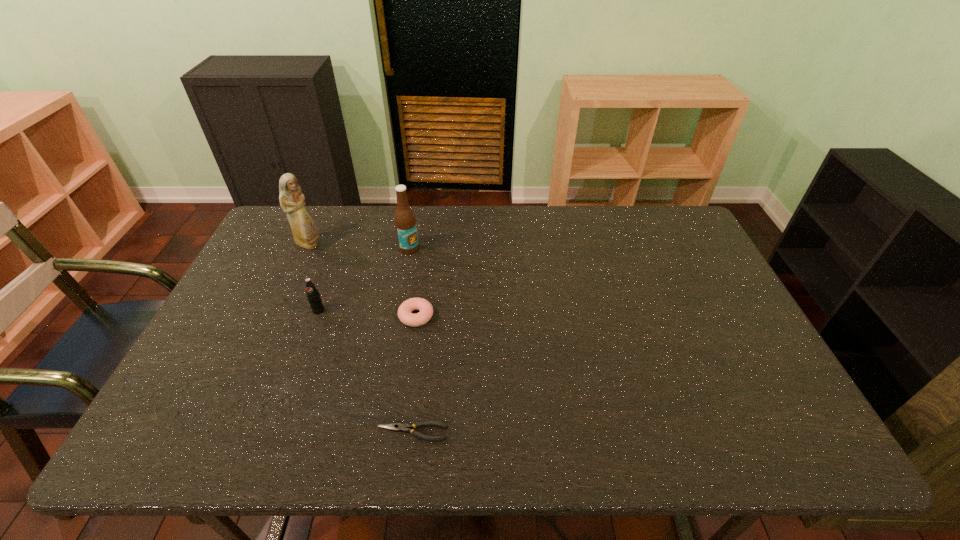
Identify the location of vacant point located between the beer bottle and the leftmost object. (359, 247).

Where is `vacant area that lies between the pop and the figurine`? The height and width of the screenshot is (540, 960). vacant area that lies between the pop and the figurine is located at coordinates (314, 278).

Choose which object is the fourth nearest neighbor to the nearest object. Please provide its 2D coordinates. Your answer should be formatted as a tuple, i.e. [(x, y)], where the tuple contains the x and y coordinates of a point satisfying the conditions above.

[(305, 231)]

Image resolution: width=960 pixels, height=540 pixels. Find the location of `object that can be found as the third closest to the beer bottle`. object that can be found as the third closest to the beer bottle is located at coordinates (313, 295).

Where is `free region that satisfies the following two spatial constraints: 1. on the front label of the pliers; 2. on the left side of the pop`? free region that satisfies the following two spatial constraints: 1. on the front label of the pliers; 2. on the left side of the pop is located at coordinates (275, 432).

Identify the location of blank area in the image that satisfies the following two spatial constraints: 1. on the front-facing side of the figurine; 2. on the back side of the beer bottle. The width and height of the screenshot is (960, 540). (307, 248).

Where is `vacant region that satisfies the following two spatial constraints: 1. on the front-facing side of the nearest object; 2. on the left side of the figurine`? vacant region that satisfies the following two spatial constraints: 1. on the front-facing side of the nearest object; 2. on the left side of the figurine is located at coordinates (225, 432).

The image size is (960, 540). I want to click on vacant position in the image that satisfies the following two spatial constraints: 1. on the front label of the second object from left to right; 2. on the left side of the fourth tallest object, so click(317, 316).

Where is `vacant space that satisfies the following two spatial constraints: 1. on the front-facing side of the leftmost object; 2. on the back side of the nearest object`? The image size is (960, 540). vacant space that satisfies the following two spatial constraints: 1. on the front-facing side of the leftmost object; 2. on the back side of the nearest object is located at coordinates (225, 432).

Locate an element on the screen. The height and width of the screenshot is (540, 960). free spot that satisfies the following two spatial constraints: 1. on the front label of the doughnut; 2. on the right side of the pop is located at coordinates (317, 316).